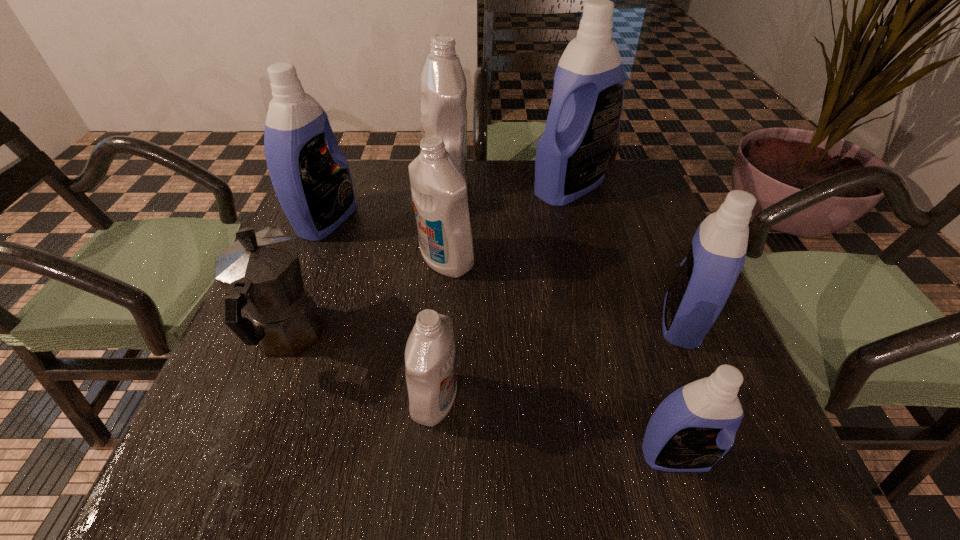
Find the location of `vacant space located 0.340m on the pouring side of the coffeepot`. vacant space located 0.340m on the pouring side of the coffeepot is located at coordinates (341, 200).

Identify the location of free space located 0.290m on the right of the nearest white detergent. (627, 400).

What are the coordinates of `vacant space situated on the back of the nearest detergent` in the screenshot? It's located at (656, 392).

Find the location of a particular element. Image resolution: width=960 pixels, height=540 pixels. detergent present at the left edge is located at coordinates (313, 184).

The height and width of the screenshot is (540, 960). In order to click on coffeepot at the left edge in this screenshot , I will do `click(260, 272)`.

Locate an element on the screen. The width and height of the screenshot is (960, 540). object at the far left corner is located at coordinates (313, 184).

Locate an element on the screen. This screenshot has width=960, height=540. object present at the far right corner is located at coordinates (572, 155).

Image resolution: width=960 pixels, height=540 pixels. I want to click on object present at the near right corner, so click(695, 426).

In the image, there is a desktop. Where is `vacant space at the far edge`? The image size is (960, 540). vacant space at the far edge is located at coordinates (564, 208).

Find the location of `vacant space at the near edge of the desktop`. vacant space at the near edge of the desktop is located at coordinates (319, 436).